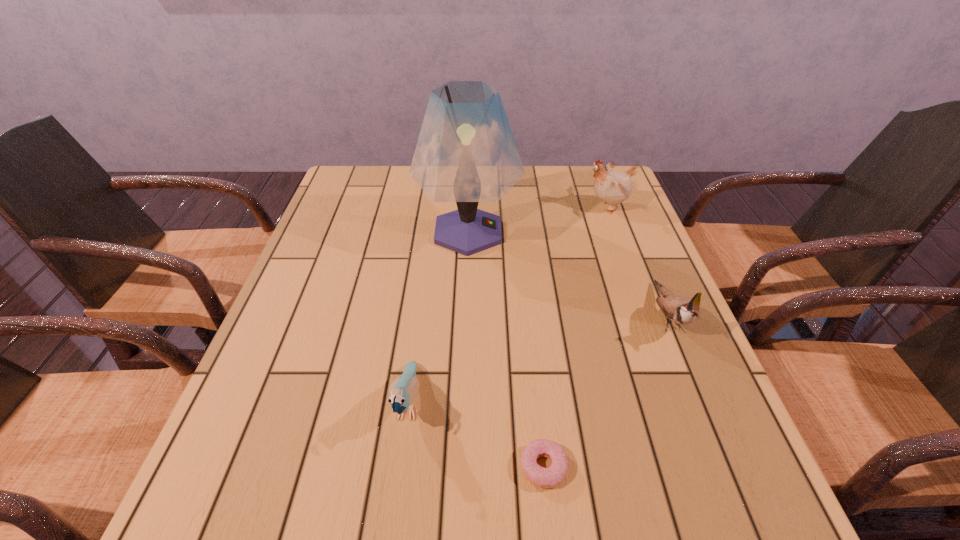
At what (x,y) coordinates should I click in order to perform the action: click on vacant point located 0.050m at the face of the nearest bird. Please return your answer as a coordinate pair (x, y). Looking at the image, I should click on (398, 477).

Where is `vacant space located 0.250m on the back of the doughnut`? vacant space located 0.250m on the back of the doughnut is located at coordinates (529, 335).

Locate an element on the screen. object that is positioned at the far edge is located at coordinates (613, 188).

Identify the location of object situated at the near edge. The image size is (960, 540). (551, 477).

Find the location of `object at the far right corner`. object at the far right corner is located at coordinates (613, 188).

The image size is (960, 540). I want to click on free space at the far edge of the desktop, so click(451, 205).

You are a GUI agent. You are given a task and a screenshot of the screen. Output one action in this format:
    pyautogui.click(x=<x>, y=<y>)
    Task: Click on the free space at the near edge of the desktop
    The image size is (960, 540).
    Given the screenshot: What is the action you would take?
    pyautogui.click(x=567, y=494)

Find the location of a particular element. The image size is (960, 540). free region at the left edge of the desktop is located at coordinates (298, 444).

In the image, there is a desktop. Where is `free space at the right edge`? free space at the right edge is located at coordinates (656, 301).

What are the coordinates of `vacant region at the near right corner` in the screenshot? It's located at (762, 531).